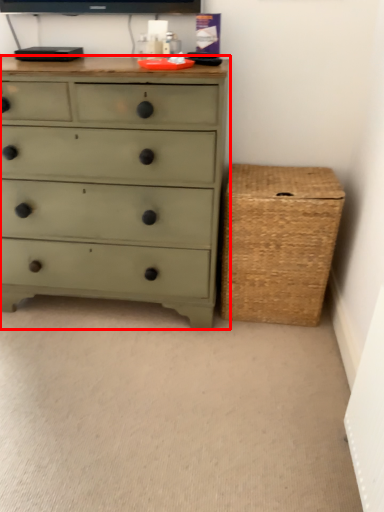
Question: From the image's perspective, considering the relative positions of chest of drawers (annotated by the red box) and basket in the image provided, where is chest of drawers (annotated by the red box) located with respect to the staircase?

Choices:
 (A) above
 (B) below

Answer: (A)